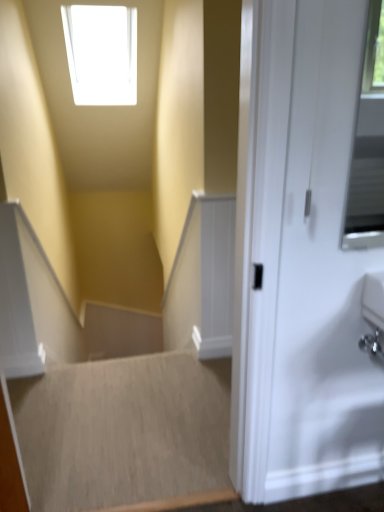
Question: Is beige carpet at lower left, placed as the 2th stairwell when sorted from front to back, positioned behind smooth beige carpet at center, the 1th stairwell positioned from the front?

Choices:
 (A) yes
 (B) no

Answer: (A)

Question: Would you say beige carpet at lower left, placed as the 2th stairwell when sorted from front to back, is a long distance from smooth beige carpet at center, which ranks as the second stairwell in back-to-front order?

Choices:
 (A) yes
 (B) no

Answer: (B)

Question: Considering the relative sizes of beige carpet at lower left, arranged as the first stairwell when viewed from the back, and smooth beige carpet at center, the 1th stairwell positioned from the front, in the image provided, is beige carpet at lower left, arranged as the first stairwell when viewed from the back, wider than smooth beige carpet at center, the 1th stairwell positioned from the front,?

Choices:
 (A) yes
 (B) no

Answer: (A)

Question: Can you confirm if beige carpet at lower left, placed as the 2th stairwell when sorted from front to back, is smaller than smooth beige carpet at center, which ranks as the second stairwell in back-to-front order?

Choices:
 (A) no
 (B) yes

Answer: (B)

Question: From the image's perspective, would you say beige carpet at lower left, placed as the 2th stairwell when sorted from front to back, is shown under smooth beige carpet at center, which ranks as the second stairwell in back-to-front order?

Choices:
 (A) no
 (B) yes

Answer: (B)

Question: From a real-world perspective, is beige carpet at lower left, arranged as the first stairwell when viewed from the back, under smooth beige carpet at center, the 1th stairwell positioned from the front?

Choices:
 (A) yes
 (B) no

Answer: (A)

Question: Is smooth beige carpet at center, the 1th stairwell positioned from the front, at the right side of beige carpet at lower left, arranged as the first stairwell when viewed from the back?

Choices:
 (A) no
 (B) yes

Answer: (B)

Question: Could you tell me if smooth beige carpet at center, the 1th stairwell positioned from the front, is facing beige carpet at lower left, placed as the 2th stairwell when sorted from front to back?

Choices:
 (A) no
 (B) yes

Answer: (A)

Question: Considering the relative positions of smooth beige carpet at center, which ranks as the second stairwell in back-to-front order, and beige carpet at lower left, placed as the 2th stairwell when sorted from front to back, in the image provided, is smooth beige carpet at center, which ranks as the second stairwell in back-to-front order, behind beige carpet at lower left, placed as the 2th stairwell when sorted from front to back,?

Choices:
 (A) no
 (B) yes

Answer: (A)

Question: Is smooth beige carpet at center, which ranks as the second stairwell in back-to-front order, thinner than beige carpet at lower left, placed as the 2th stairwell when sorted from front to back?

Choices:
 (A) no
 (B) yes

Answer: (B)

Question: Is smooth beige carpet at center, the 1th stairwell positioned from the front, beside beige carpet at lower left, arranged as the first stairwell when viewed from the back?

Choices:
 (A) yes
 (B) no

Answer: (B)

Question: From a real-world perspective, is smooth beige carpet at center, the 1th stairwell positioned from the front, over beige carpet at lower left, placed as the 2th stairwell when sorted from front to back?

Choices:
 (A) no
 (B) yes

Answer: (B)

Question: In terms of height, does smooth beige carpet at center, which ranks as the second stairwell in back-to-front order, look taller or shorter compared to beige carpet at lower left, placed as the 2th stairwell when sorted from front to back?

Choices:
 (A) short
 (B) tall

Answer: (B)